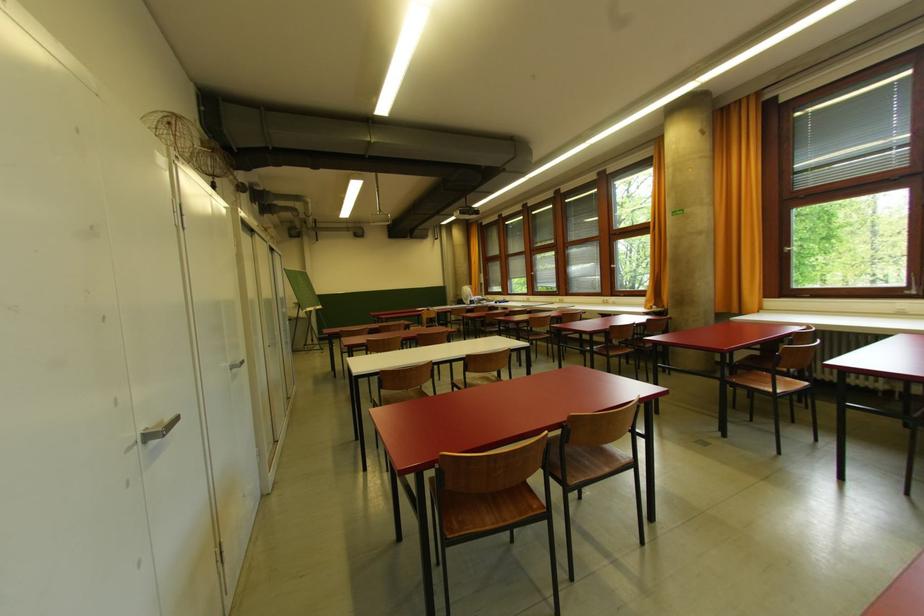
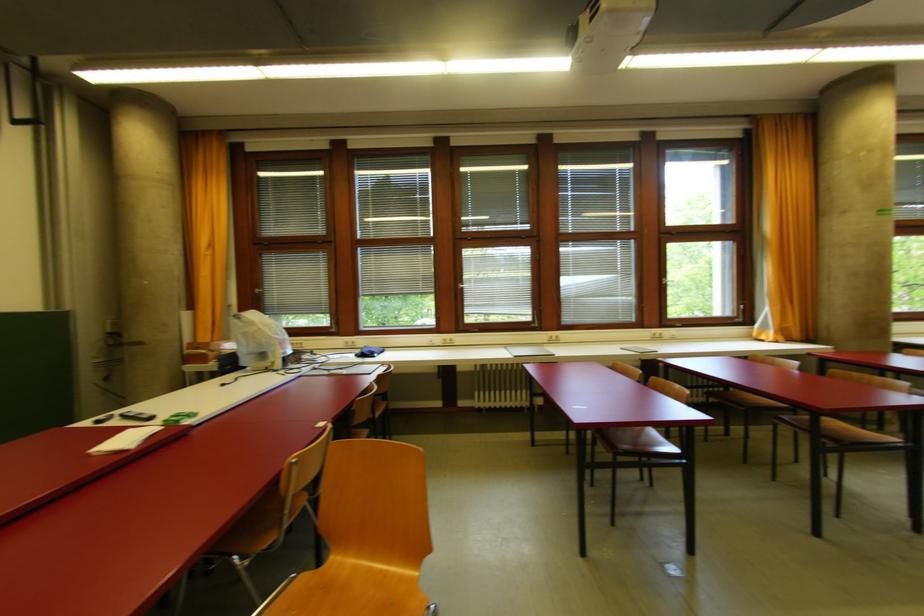
Locate, in the second image, the point that corresponds to (x=608, y=302) in the first image.

(660, 338)